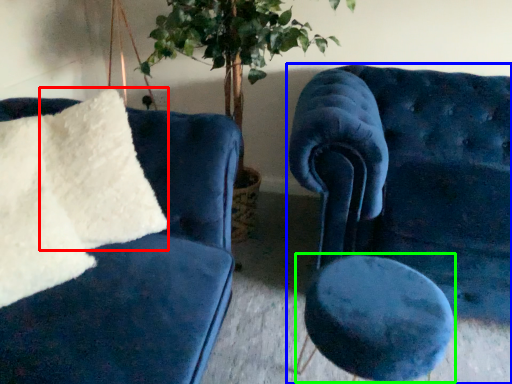
Question: Estimate the real-world distances between objects in this image. Which object is closer to pillow (highlighted by a red box), chair (highlighted by a blue box) or stool (highlighted by a green box)?

Choices:
 (A) chair
 (B) stool

Answer: (B)